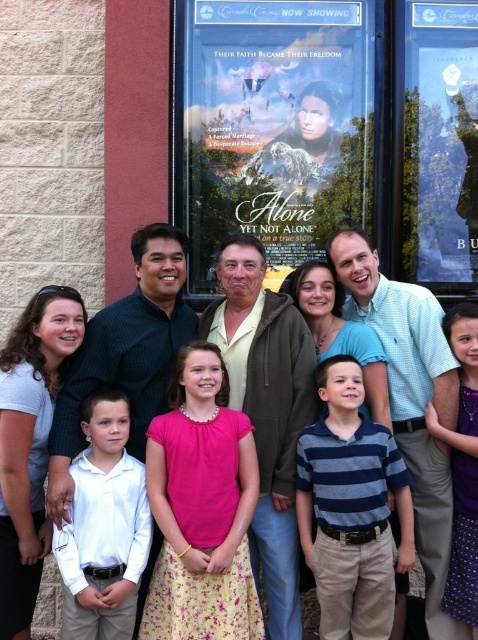
You are a photographer who just took a picture of a group of people in front of a movie theater. In the photo, you see a white cotton shirt at center and a pink fabric dress at center. Which clothing item is positioned more to the left?

The white cotton shirt at center is positioned more to the left than the pink fabric dress at center.

You are a photographer trying to adjust the lighting for a group photo. You notice the matte yellow shirt at center and the metallic silver poster at upper right. Which object is positioned lower in the scene?

The matte yellow shirt at center is located below the metallic silver poster at upper right, so it is positioned lower in the scene.

You are a photographer trying to adjust the lighting for the group photo. Since the matte yellow shirt at center and the pink fabric dress at center are both at the center, which one might cast a narrower shadow due to its shape?

The matte yellow shirt at center is thinner than the pink fabric dress at center, so it would cast a narrower shadow.